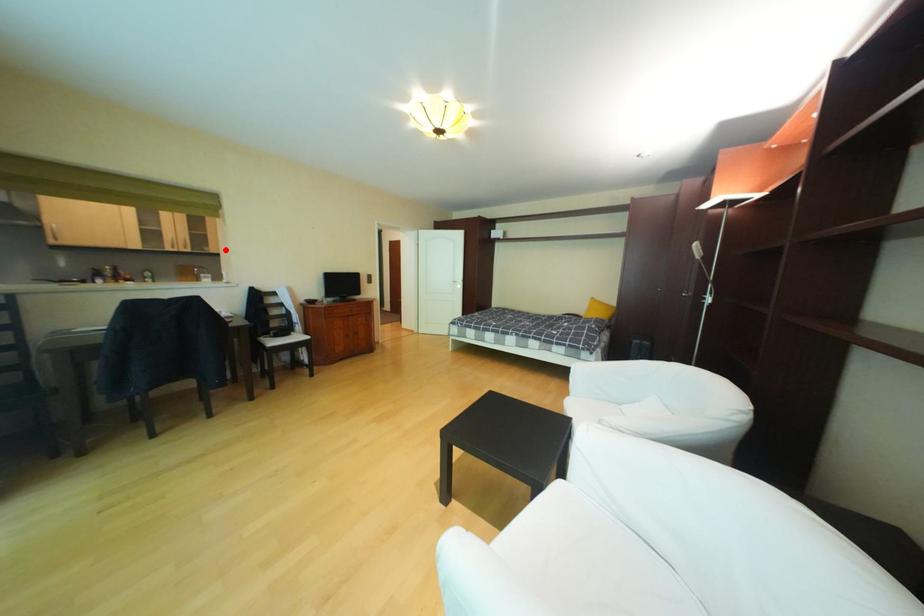
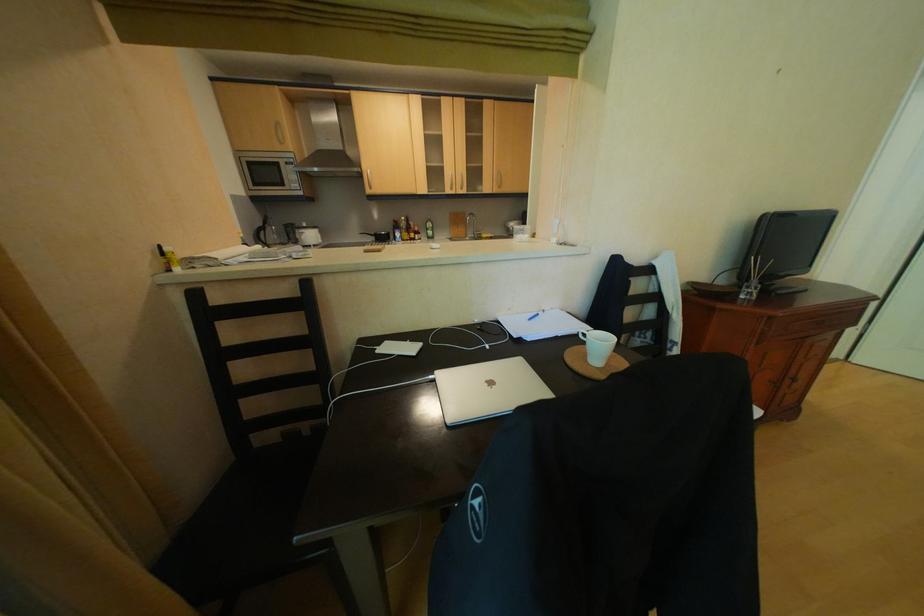
Find the pixel in the second image that matches the highlighted location in the first image.

(499, 188)